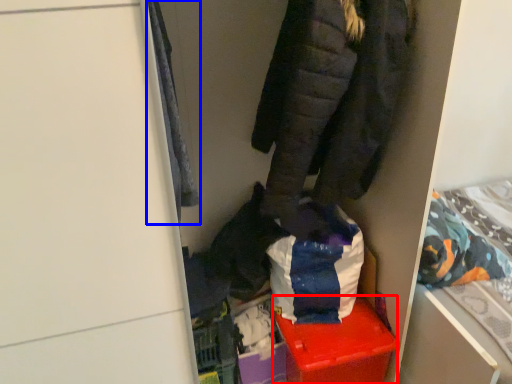
Question: Which object appears farthest to the camera in this image, storage box (highlighted by a red box) or cloak (highlighted by a blue box)?

Choices:
 (A) storage box
 (B) cloak

Answer: (A)